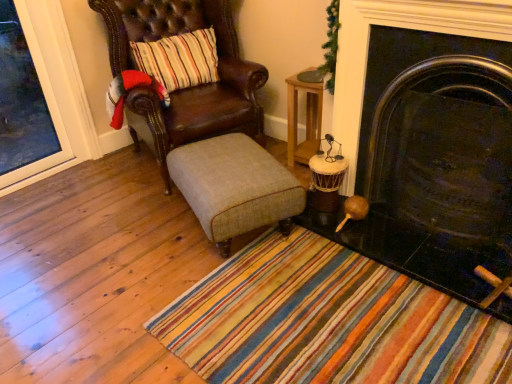
Question: Does black glossy fireplace at right touch beige fabric stool at center?

Choices:
 (A) yes
 (B) no

Answer: (B)

Question: Is black glossy fireplace at right further to the viewer compared to beige fabric stool at center?

Choices:
 (A) yes
 (B) no

Answer: (B)

Question: Is black glossy fireplace at right positioned in front of beige fabric stool at center?

Choices:
 (A) no
 (B) yes

Answer: (B)

Question: Can you confirm if black glossy fireplace at right is positioned to the right of beige fabric stool at center?

Choices:
 (A) no
 (B) yes

Answer: (B)

Question: From a real-world perspective, is black glossy fireplace at right located beneath beige fabric stool at center?

Choices:
 (A) no
 (B) yes

Answer: (A)

Question: Is black glossy fireplace at right not inside beige fabric stool at center?

Choices:
 (A) yes
 (B) no

Answer: (A)

Question: Can you confirm if black glossy fireplace at right is positioned to the left of leather chair at left?

Choices:
 (A) no
 (B) yes

Answer: (A)

Question: Are black glossy fireplace at right and leather chair at left making contact?

Choices:
 (A) no
 (B) yes

Answer: (A)

Question: From a real-world perspective, does black glossy fireplace at right stand above leather chair at left?

Choices:
 (A) yes
 (B) no

Answer: (B)

Question: Is black glossy fireplace at right far from leather chair at left?

Choices:
 (A) no
 (B) yes

Answer: (B)

Question: From the image's perspective, would you say black glossy fireplace at right is shown under leather chair at left?

Choices:
 (A) no
 (B) yes

Answer: (B)

Question: Is black glossy fireplace at right in front of leather chair at left?

Choices:
 (A) yes
 (B) no

Answer: (A)

Question: Does black glossy fireplace at right appear on the right side of wooden candle holder at lower right?

Choices:
 (A) no
 (B) yes

Answer: (B)